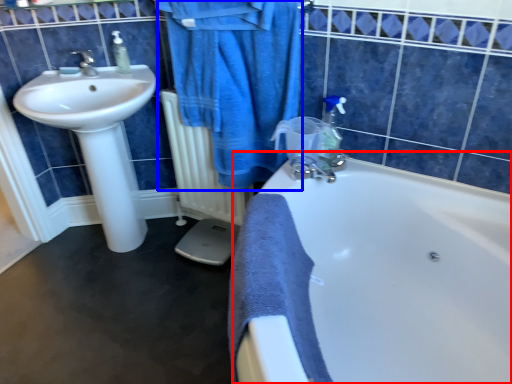
Question: Which object appears closest to the camera in this image, bathtub (highlighted by a red box) or bathrobe (highlighted by a blue box)?

Choices:
 (A) bathtub
 (B) bathrobe

Answer: (A)